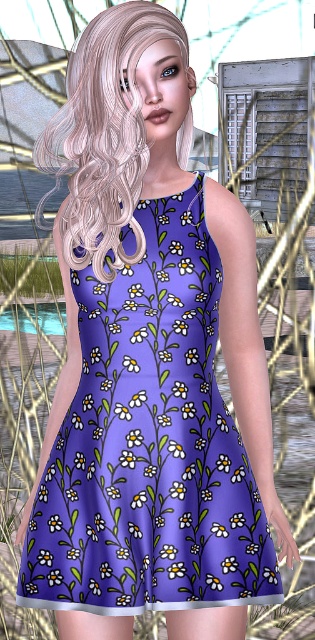
Where is `purple floral dress at center`? The width and height of the screenshot is (315, 640). purple floral dress at center is located at coordinates (149, 444).

Can you confirm if purple floral dress at center is bigger than blondehair at center?

Actually, purple floral dress at center might be smaller than blondehair at center.

Describe the element at coordinates (149, 444) in the screenshot. Image resolution: width=315 pixels, height=640 pixels. I see `purple floral dress at center` at that location.

Find the location of a particular element. purple floral dress at center is located at coordinates (149, 444).